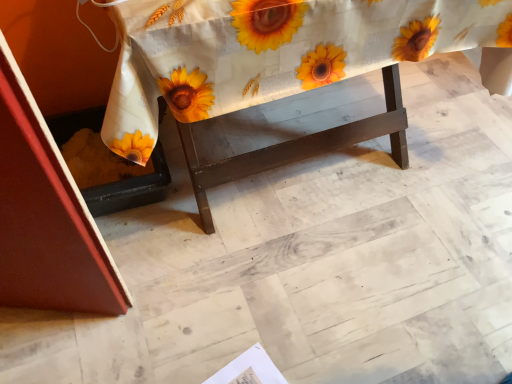
What is the approximate width of wooden table at center?

The width of wooden table at center is 66.88 centimeters.

What is the approximate height of wooden table at center?

It is 26.38 inches.

Describe the element at coordinates (282, 73) in the screenshot. I see `wooden table at center` at that location.

At what (x,y) coordinates should I click in order to perform the action: click on wooden table at center. Please return your answer as a coordinate pair (x, y). Image resolution: width=512 pixels, height=384 pixels. Looking at the image, I should click on (282, 73).

Find the location of `wooden table at center`. wooden table at center is located at coordinates (282, 73).